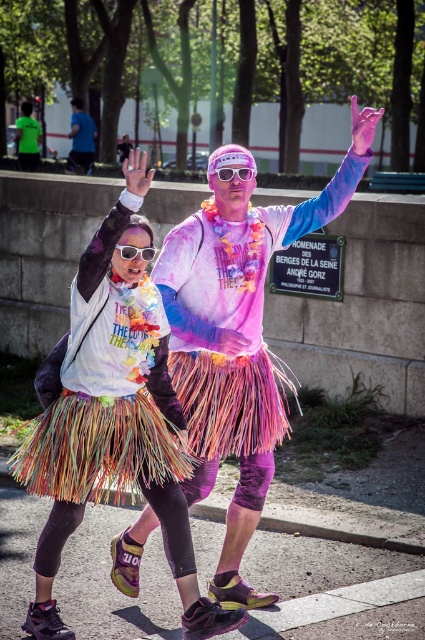
You are a photographer trying to capture the rainbow grass skirt at center in the image. The image has a point marked at coordinate (121,401). Where should you focus your camera to ensure the rainbow grass skirt at center is in focus?

The point at coordinate (121,401) corresponds to the rainbow grass skirt at center, so focusing there will ensure it is in focus.

You are at an outdoor event and want to choose a pair of goggles to protect your eyes from the colorful powder. You have two options in front of you. The pink plastic goggles at center and the clear plastic goggles at upper center. Which pair is smaller in size?

The pink plastic goggles at center is smaller in size compared to the clear plastic goggles at upper center, so you should choose the pink plastic goggles at center if you want a smaller pair.